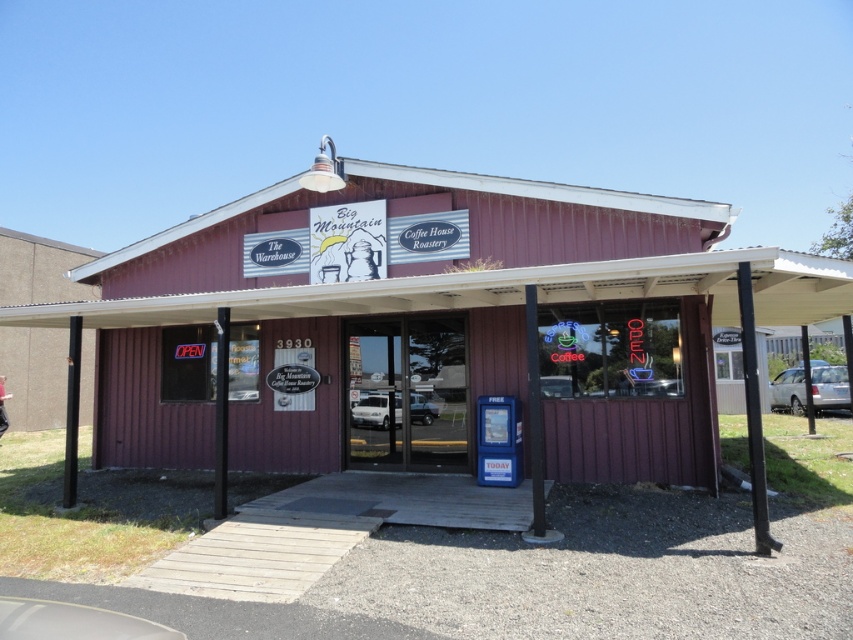
Looking at this image, you are a delivery driver who needs to park your vehicle. The parking spot available is 5 meters long. You have a satin silver sedan at right and a white matte van at center. Which vehicle can fit into the parking spot?

The satin silver sedan at right is larger in size than the white matte van at center. Since the parking spot is 5 meters long, the white matte van at center is smaller and can fit into the parking spot, while the satin silver sedan at right may be too large.

You are a delivery driver who needs to park your vehicle in front of the Big Mountain Coffee House Roastery. The parking space available is exactly the size of the white matte car at center. Can your van, which is the same size as the white matte van at center, fit into this parking space?

The white matte van at center is larger in size than the white matte car at center. Since the parking space is the same size as the car, the van cannot fit into the space.